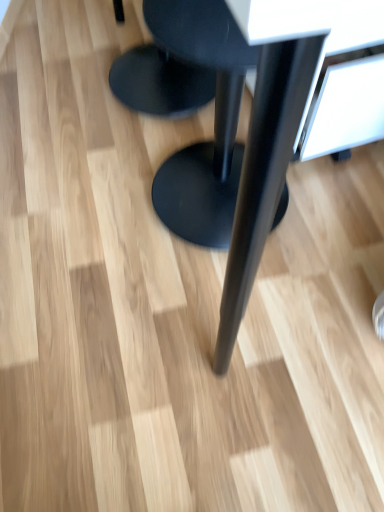
Question: Is black matte stool at center, which is the second stool in top-to-bottom order, bigger than black matte table at center?

Choices:
 (A) no
 (B) yes

Answer: (A)

Question: Is black matte stool at center, placed as the 1th stool when sorted from bottom to top, facing away from black matte table at center?

Choices:
 (A) no
 (B) yes

Answer: (B)

Question: Considering the relative positions of black matte stool at center, which is the second stool in top-to-bottom order, and black matte table at center in the image provided, is black matte stool at center, which is the second stool in top-to-bottom order, behind black matte table at center?

Choices:
 (A) no
 (B) yes

Answer: (B)

Question: Considering the relative sizes of black matte stool at center, placed as the 1th stool when sorted from bottom to top, and black matte table at center in the image provided, is black matte stool at center, placed as the 1th stool when sorted from bottom to top, thinner than black matte table at center?

Choices:
 (A) no
 (B) yes

Answer: (B)

Question: Is black matte stool at center, which is the second stool in top-to-bottom order, to the left of black matte table at center from the viewer's perspective?

Choices:
 (A) no
 (B) yes

Answer: (B)

Question: Which is correct: black matte stool at center, placed as the 1th stool when sorted from bottom to top, is inside black matte stool at center, the 2th stool positioned from the bottom, or outside of it?

Choices:
 (A) outside
 (B) inside

Answer: (A)

Question: Is point (173, 229) closer or farther from the camera than point (183, 93)?

Choices:
 (A) farther
 (B) closer

Answer: (B)

Question: Based on their positions, is black matte stool at center, placed as the 1th stool when sorted from bottom to top, located to the left or right of black matte stool at center, which is the first stool from top to bottom?

Choices:
 (A) left
 (B) right

Answer: (B)

Question: From a real-world perspective, is black matte stool at center, which is the second stool in top-to-bottom order, above or below black matte stool at center, the 2th stool positioned from the bottom?

Choices:
 (A) below
 (B) above

Answer: (B)

Question: Relative to black matte stool at center, the 2th stool positioned from the bottom, is black matte table at center in front or behind?

Choices:
 (A) behind
 (B) front

Answer: (B)

Question: Considering the positions of black matte table at center and black matte stool at center, the 2th stool positioned from the bottom, in the image, is black matte table at center wider or thinner than black matte stool at center, the 2th stool positioned from the bottom,?

Choices:
 (A) thin
 (B) wide

Answer: (B)

Question: Is point (251, 259) positioned closer to the camera than point (142, 91)?

Choices:
 (A) closer
 (B) farther

Answer: (A)

Question: Is black matte table at center taller or shorter than black matte stool at center, the 2th stool positioned from the bottom?

Choices:
 (A) short
 (B) tall

Answer: (B)

Question: Considering the positions of black matte stool at center, which is the first stool from top to bottom, and black matte stool at center, which is the second stool in top-to-bottom order, in the image, is black matte stool at center, which is the first stool from top to bottom, taller or shorter than black matte stool at center, which is the second stool in top-to-bottom order,?

Choices:
 (A) short
 (B) tall

Answer: (A)

Question: From a real-world perspective, is black matte stool at center, which is the first stool from top to bottom, physically located above or below black matte stool at center, placed as the 1th stool when sorted from bottom to top?

Choices:
 (A) above
 (B) below

Answer: (B)